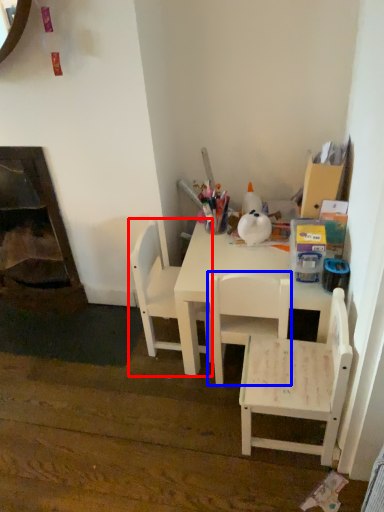
Question: Among these objects, which one is nearest to the camera, chair (highlighted by a red box) or chair (highlighted by a blue box)?

Choices:
 (A) chair
 (B) chair

Answer: (B)